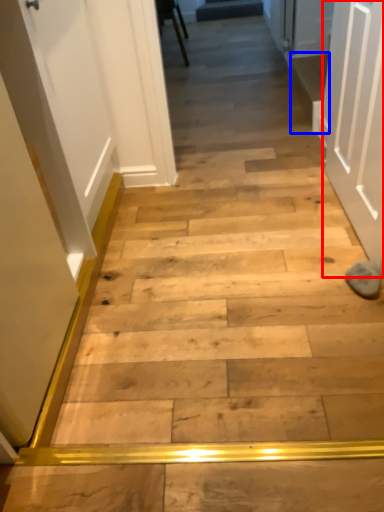
Question: Which point is closer to the camera, door (highlighted by a red box) or stairwell (highlighted by a blue box)?

Choices:
 (A) door
 (B) stairwell

Answer: (A)